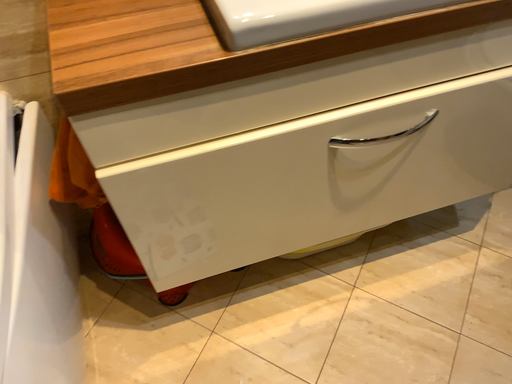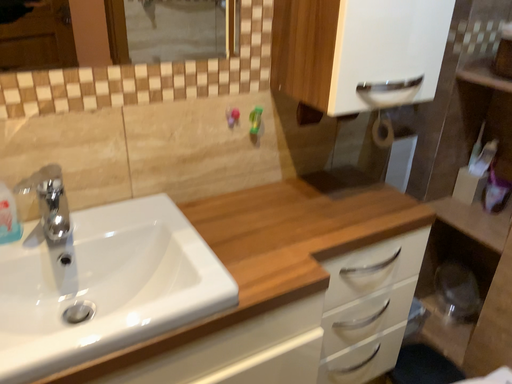
Question: How did the camera likely rotate when shooting the video?

Choices:
 (A) rotated right
 (B) rotated left

Answer: (A)